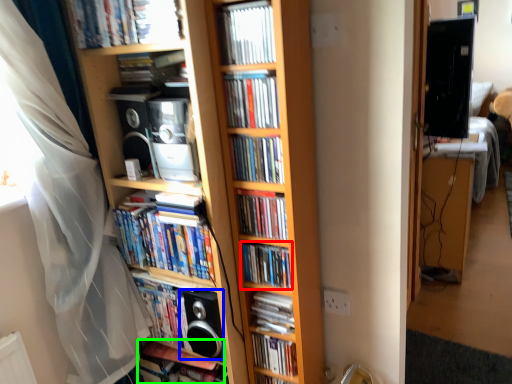
Question: Which object is the closest to the book (highlighted by a red box)? Choose among these: speaker (highlighted by a blue box) or book (highlighted by a green box).

Choices:
 (A) speaker
 (B) book

Answer: (A)